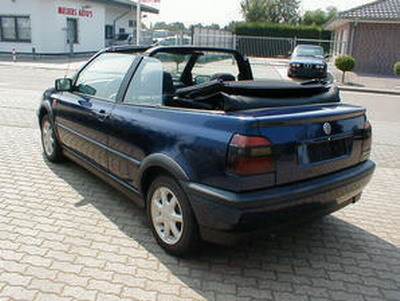
Where is `back lights`? back lights is located at coordinates click(x=245, y=143), click(x=245, y=164).